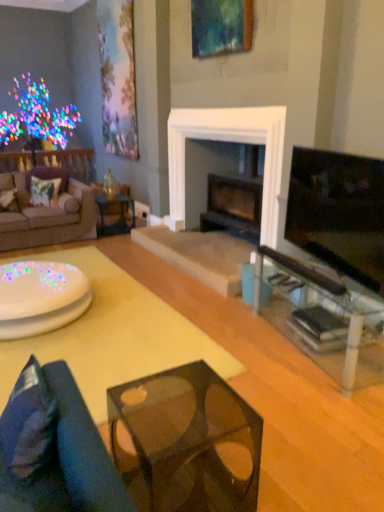
The image size is (384, 512). In order to click on free spot to the right of white glossy table at lower left, which is counted as the first table, starting from the left in this screenshot , I will do `click(131, 315)`.